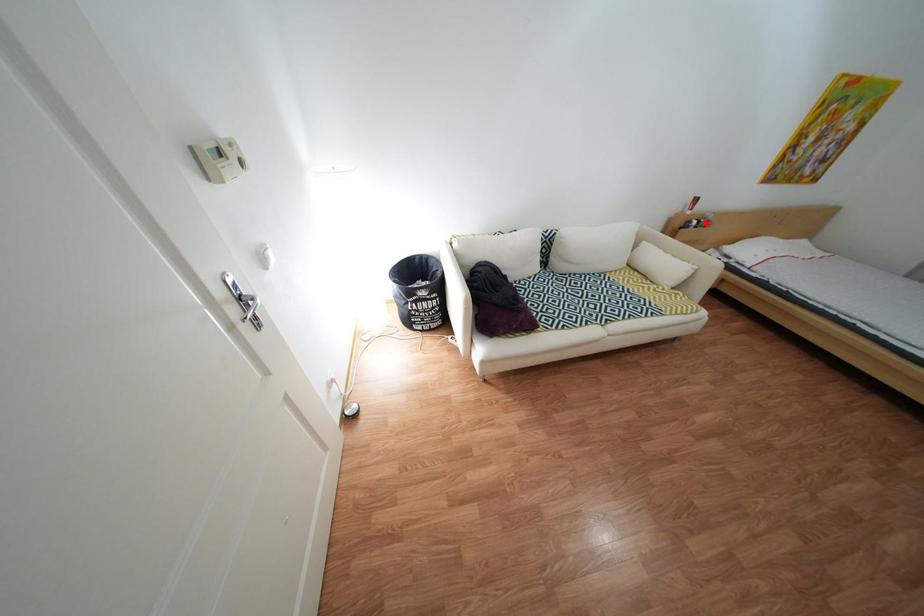
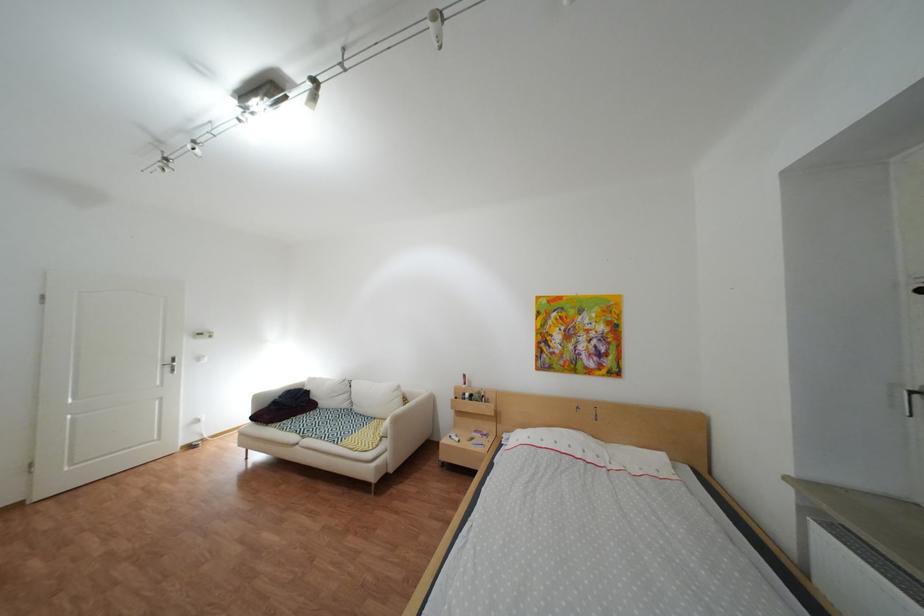
Question: I am providing you with two images of the same scene from different viewpoints. Given a red point in image1, look at the same physical point in image2. Is it:

Choices:
 (A) Closer to the viewpoint
 (B) Farther from the viewpoint

Answer: (B)